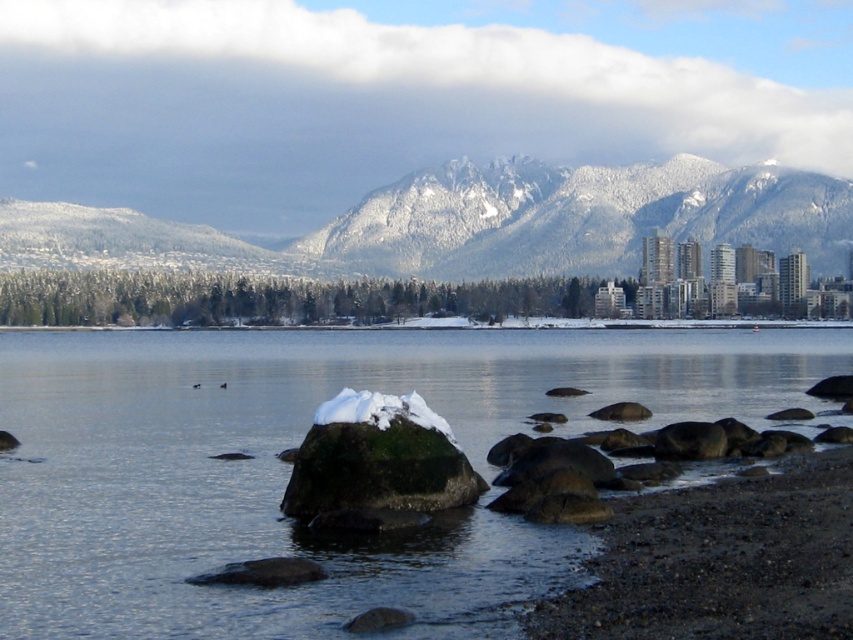
Question: Which point is farther to the camera?

Choices:
 (A) (183, 378)
 (B) (279, 269)
 (C) (368, 410)

Answer: (B)

Question: Considering the relative positions of clear water at center and snowy granite mountains at upper center in the image provided, where is clear water at center located with respect to snowy granite mountains at upper center?

Choices:
 (A) right
 (B) left

Answer: (A)

Question: Does clear water at center appear on the left side of snowy granite mountains at upper center?

Choices:
 (A) yes
 (B) no

Answer: (B)

Question: Is clear water at center below white fluffy snow at center?

Choices:
 (A) yes
 (B) no

Answer: (B)

Question: Which point is closer to the camera?

Choices:
 (A) snowy granite mountains at upper center
 (B) clear water at center

Answer: (B)

Question: Estimate the real-world distances between objects in this image. Which object is farther from the snowy granite mountains at upper center?

Choices:
 (A) clear water at center
 (B) white fluffy snow at center

Answer: (B)